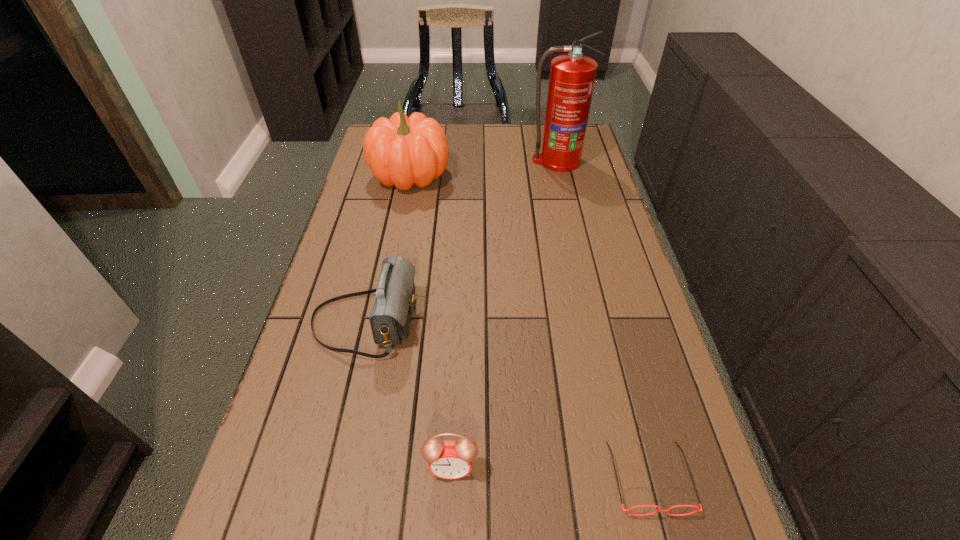
Locate an element on the screen. This screenshot has height=540, width=960. vacant region at the right edge of the desktop is located at coordinates (599, 341).

This screenshot has height=540, width=960. In the image, there is a desktop. In order to click on vacant space at the far right corner in this screenshot , I will do `click(592, 154)`.

At what (x,y) coordinates should I click in order to perform the action: click on free space between the fire extinguisher and the third farthest object. Please return your answer as a coordinate pair (x, y). This screenshot has height=540, width=960. Looking at the image, I should click on (461, 241).

Find the location of `empty space that is in between the third nearest object and the pumpkin`. empty space that is in between the third nearest object and the pumpkin is located at coordinates (388, 248).

Locate an element on the screen. This screenshot has height=540, width=960. vacant space in between the pumpkin and the tallest object is located at coordinates (484, 168).

Find the location of a particular element. This screenshot has width=960, height=540. vacant space in between the second shortest object and the shoulder bag is located at coordinates (408, 394).

At what (x,y) coordinates should I click in order to perform the action: click on vacant area that lies between the shortest object and the fire extinguisher. Please return your answer as a coordinate pair (x, y). Image resolution: width=960 pixels, height=540 pixels. Looking at the image, I should click on (603, 319).

You are a GUI agent. You are given a task and a screenshot of the screen. Output one action in this format:
    pyautogui.click(x=<x>, y=<y>)
    Task: Click on the unoccupied area between the shoulder bag and the tallest object
    
    Given the screenshot: What is the action you would take?
    pyautogui.click(x=461, y=241)

Find the location of a particular element. The image size is (960, 540). vacant area that lies between the fire extinguisher and the shortest object is located at coordinates (603, 319).

Identify the location of vacant point located between the fourth shortest object and the shoulder bag. This screenshot has height=540, width=960. (388, 248).